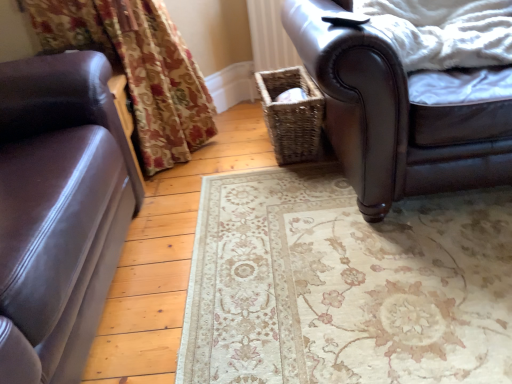
Question: Is white fluffy blanket at upper right in front of brown leather chair at upper right?

Choices:
 (A) yes
 (B) no

Answer: (B)

Question: From the image's perspective, is white fluffy blanket at upper right beneath brown leather chair at upper right?

Choices:
 (A) yes
 (B) no

Answer: (B)

Question: Is white fluffy blanket at upper right at the right side of brown leather chair at upper right?

Choices:
 (A) yes
 (B) no

Answer: (A)

Question: Does white fluffy blanket at upper right lie behind brown leather chair at upper right?

Choices:
 (A) yes
 (B) no

Answer: (A)

Question: Is white fluffy blanket at upper right outside of brown leather chair at upper right?

Choices:
 (A) no
 (B) yes

Answer: (A)

Question: Is white fluffy blanket at upper right to the left of brown leather chair at upper right from the viewer's perspective?

Choices:
 (A) no
 (B) yes

Answer: (A)

Question: Does matte brown leather couch at left have a greater height compared to brown leather chair at upper right?

Choices:
 (A) yes
 (B) no

Answer: (A)

Question: Considering the relative sizes of matte brown leather couch at left and brown leather chair at upper right in the image provided, is matte brown leather couch at left wider than brown leather chair at upper right?

Choices:
 (A) yes
 (B) no

Answer: (B)

Question: From a real-world perspective, is matte brown leather couch at left physically below brown leather chair at upper right?

Choices:
 (A) yes
 (B) no

Answer: (B)

Question: From a real-world perspective, is matte brown leather couch at left on brown leather chair at upper right?

Choices:
 (A) yes
 (B) no

Answer: (A)

Question: Is matte brown leather couch at left outside brown leather chair at upper right?

Choices:
 (A) yes
 (B) no

Answer: (A)

Question: Is matte brown leather couch at left touching brown leather chair at upper right?

Choices:
 (A) yes
 (B) no

Answer: (B)

Question: Could you tell me if brown leather chair at upper right is turned towards woven brown basket at center?

Choices:
 (A) no
 (B) yes

Answer: (A)